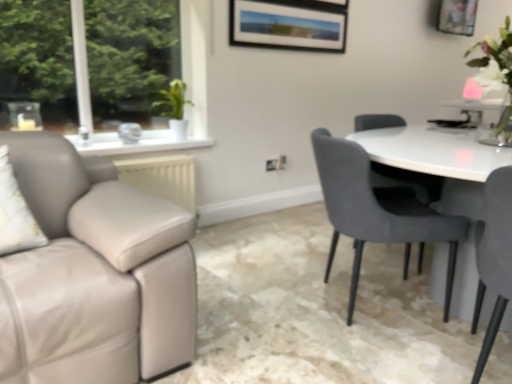
Question: Which is correct: velvet grey chair at right, the 1th chair positioned from the back, is inside wooden picture frame at upper right, or outside of it?

Choices:
 (A) inside
 (B) outside

Answer: (B)

Question: In terms of height, does velvet grey chair at right, the 1th chair positioned from the back, look taller or shorter compared to wooden picture frame at upper right?

Choices:
 (A) tall
 (B) short

Answer: (A)

Question: Which is nearer to the matte gray chair at right, the second chair viewed from the back?

Choices:
 (A) wooden picture frame at upper right
 (B) white glossy vase at upper right
 (C) velvet grey chair at right, which is the 2th chair from front to back

Answer: (C)

Question: Considering the real-world distances, which object is farthest from the velvet grey chair at right, which is the 2th chair from front to back?

Choices:
 (A) matte gray chair at right, the second chair viewed from the back
 (B) wooden picture frame at upper right
 (C) white glossy vase at upper right

Answer: (B)